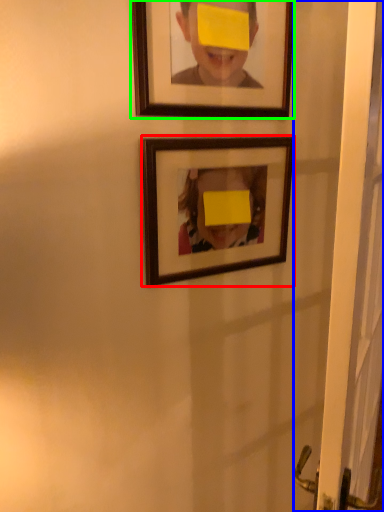
Question: Estimate the real-world distances between objects in this image. Which object is closer to picture frame (highlighted by a red box), screen door (highlighted by a blue box) or picture frame (highlighted by a green box)?

Choices:
 (A) screen door
 (B) picture frame

Answer: (B)